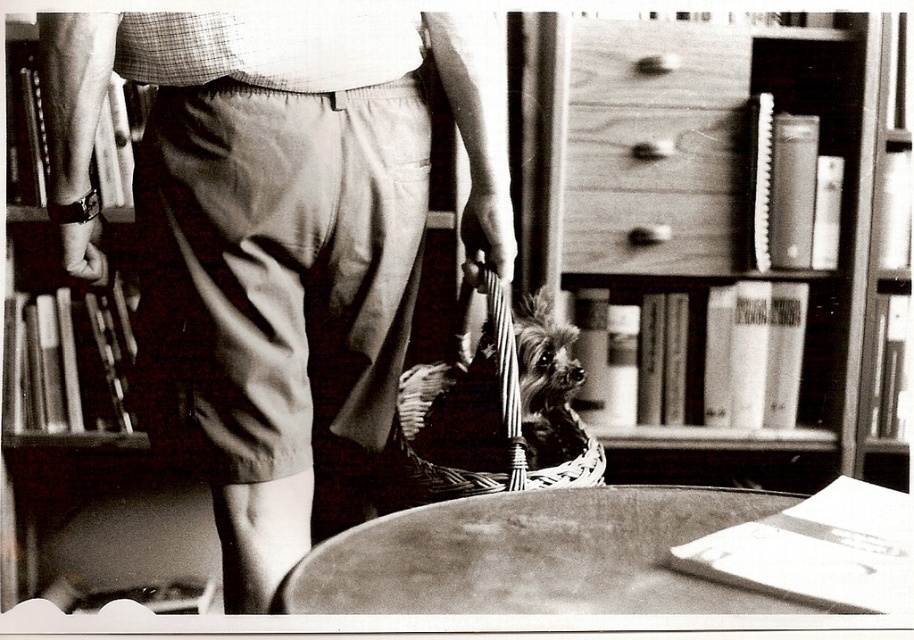
Between wooden bookshelf at upper center and wooden drawer at upper center, which one appears on the right side from the viewer's perspective?

Positioned to the right is wooden bookshelf at upper center.

Is point (707, 445) positioned before point (714, 269)?

No, it is behind (714, 269).

You are a GUI agent. You are given a task and a screenshot of the screen. Output one action in this format:
    pyautogui.click(x=<x>, y=<y>)
    Task: Click on the wooden bookshelf at upper center
    This screenshot has width=914, height=640.
    Given the screenshot: What is the action you would take?
    pyautogui.click(x=711, y=212)

Who is positioned more to the left, wooden drawer at upper center or smooth wooden table at center?

smooth wooden table at center is more to the left.

Can you confirm if wooden drawer at upper center is thinner than smooth wooden table at center?

Correct, wooden drawer at upper center's width is less than smooth wooden table at center's.

Where is `wooden drawer at upper center`? This screenshot has width=914, height=640. wooden drawer at upper center is located at coordinates (654, 147).

Can you confirm if smooth wooden table at center is taller than fuzzy brown dog at center?

No.

Is smooth wooden table at center bigger than fuzzy brown dog at center?

Incorrect, smooth wooden table at center is not larger than fuzzy brown dog at center.

Is point (408, 520) positioned before point (555, 358)?

Yes, point (408, 520) is closer to viewer.

The height and width of the screenshot is (640, 914). What are the coordinates of `smooth wooden table at center` in the screenshot? It's located at (484, 540).